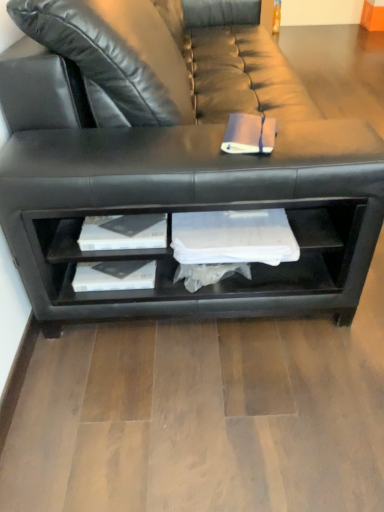
Question: Is pink matte book at center situated inside black leather couch at center or outside?

Choices:
 (A) inside
 (B) outside

Answer: (A)

Question: Is point (235, 116) positioned closer to the camera than point (334, 309)?

Choices:
 (A) closer
 (B) farther

Answer: (A)

Question: From a real-world perspective, is pink matte book at center physically located above or below black leather couch at center?

Choices:
 (A) above
 (B) below

Answer: (A)

Question: Is point (41, 206) closer or farther from the camera than point (271, 147)?

Choices:
 (A) closer
 (B) farther

Answer: (B)

Question: Considering the positions of black leather couch at center and pink matte book at center in the image, is black leather couch at center bigger or smaller than pink matte book at center?

Choices:
 (A) small
 (B) big

Answer: (B)

Question: Based on their positions, is black leather couch at center located to the left or right of pink matte book at center?

Choices:
 (A) right
 (B) left

Answer: (B)

Question: From the image's perspective, is black leather couch at center above or below pink matte book at center?

Choices:
 (A) above
 (B) below

Answer: (A)